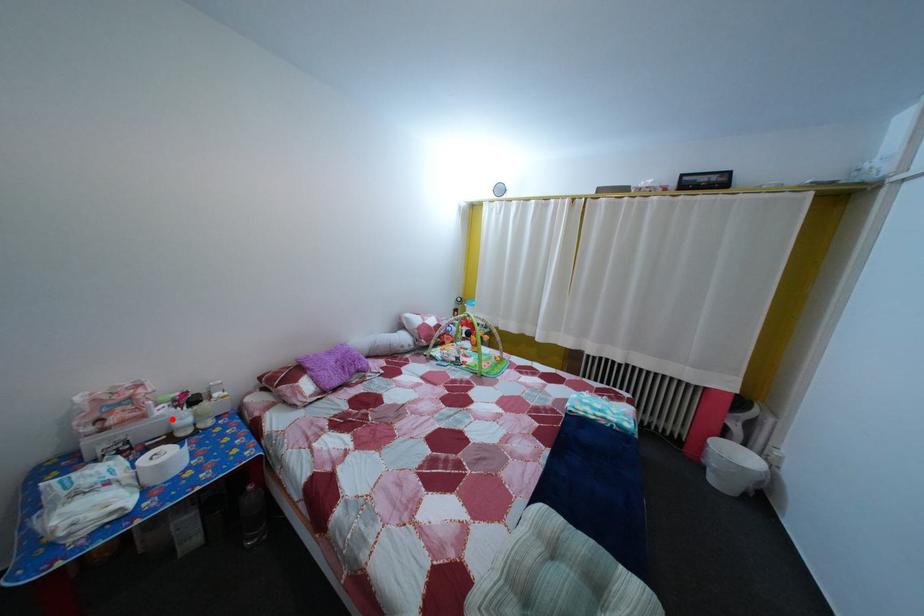
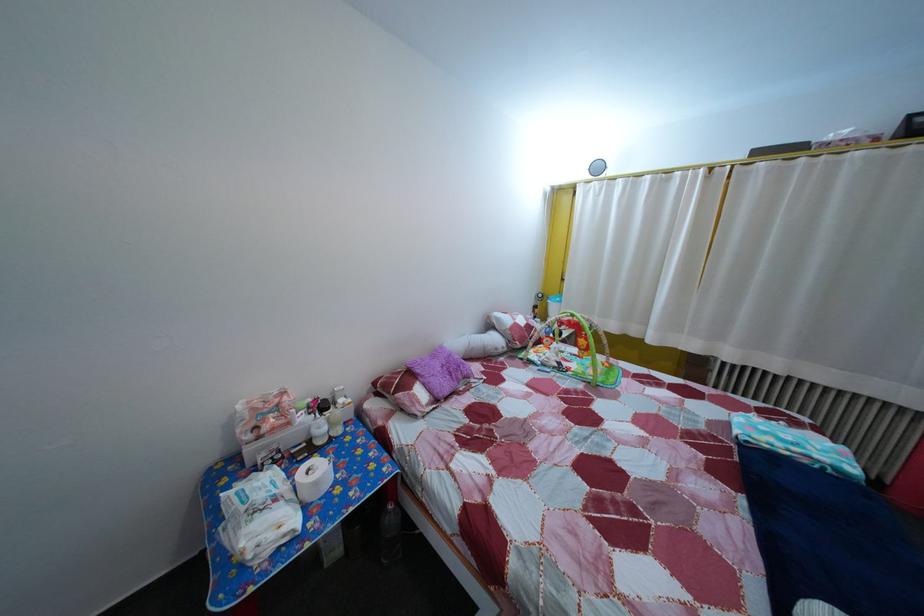
Locate, in the second image, the point that corresponds to the highlighted location in the first image.

(311, 427)